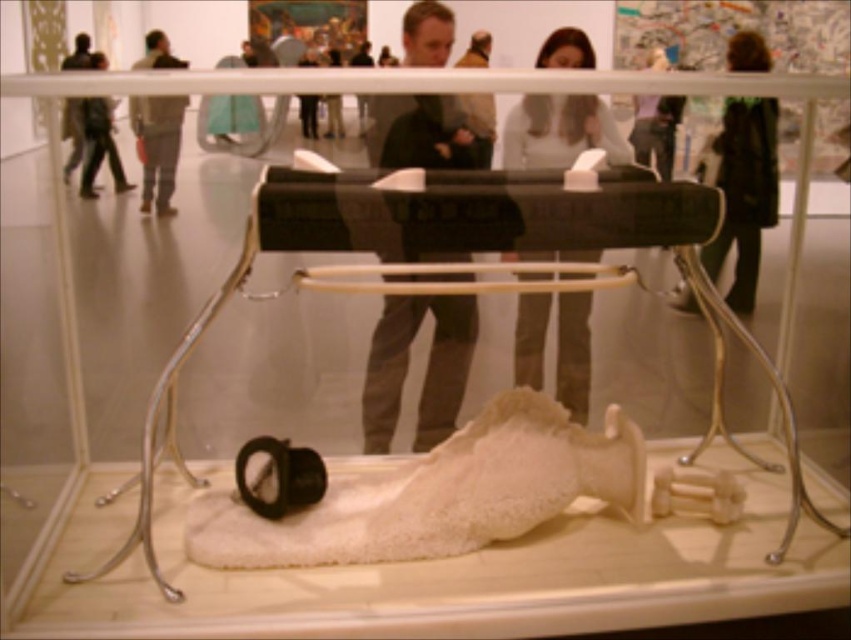
Question: Which point is farther to the camera?

Choices:
 (A) (375, 348)
 (B) (737, 264)
 (C) (141, 65)
 (D) (580, 314)

Answer: (D)

Question: Which point is closer to the camera?

Choices:
 (A) dark gray fabric jacket at center
 (B) dark brown leather jacket at upper right
 (C) gray fabric jacket at upper left

Answer: (A)

Question: Can you confirm if dark gray fabric jacket at center is bigger than dark brown leather jacket at upper right?

Choices:
 (A) yes
 (B) no

Answer: (A)

Question: Can you confirm if dark brown leather jacket at upper right is positioned above gray fabric jacket at upper left?

Choices:
 (A) yes
 (B) no

Answer: (B)

Question: Which object appears closest to the camera in this image?

Choices:
 (A) gray fabric jacket at upper left
 (B) matte black laptop at upper center
 (C) dark brown leather jacket at upper right
 (D) dark gray fabric jacket at center

Answer: (D)

Question: Is matte black laptop at upper center below dark brown leather jacket at upper right?

Choices:
 (A) no
 (B) yes

Answer: (B)